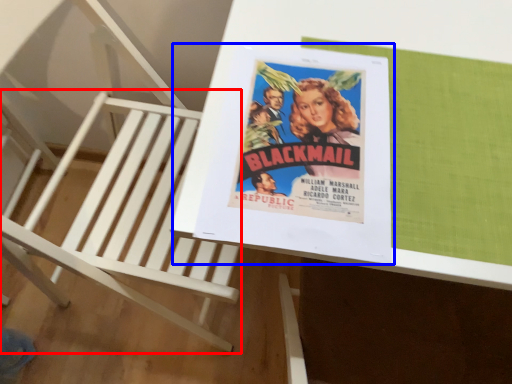
Question: Which object appears farthest to the camera in this image, furniture (highlighted by a red box) or paperback book (highlighted by a blue box)?

Choices:
 (A) furniture
 (B) paperback book

Answer: (B)